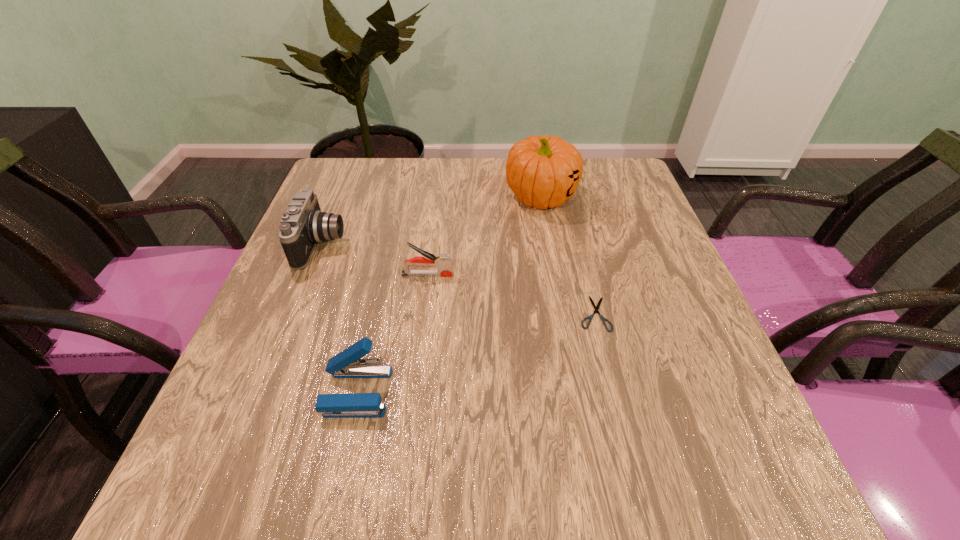
The width and height of the screenshot is (960, 540). Identify the location of free space that satisfies the following two spatial constraints: 1. on the back side of the shears; 2. on the front-facing side of the leftmost object. (577, 245).

The image size is (960, 540). What are the coordinates of `vacant space that satisfies the following two spatial constraints: 1. on the front-facing side of the nearest object; 2. on the right side of the camera` in the screenshot? It's located at (263, 392).

The width and height of the screenshot is (960, 540). Identify the location of vacant space that satisfies the following two spatial constraints: 1. on the handle side of the fourth farthest object; 2. on the right side of the farther stapler. (422, 313).